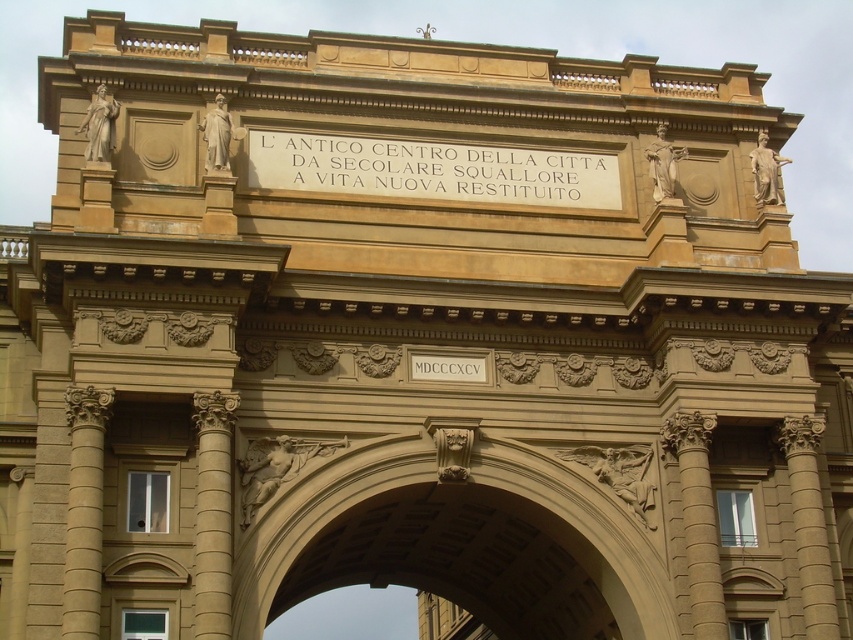
You are an architect inspecting the archway structure. You notice two columns, the beige stone column at left and the brown stone column at right. Which column is shorter?

The beige stone column at left is shorter than the brown stone column at right.

You are an architect examining the archway and need to determine the spatial relationship between the beige stone column at left and the brown stone column at right. Which column is closer to you as you face the archway?

The beige stone column at left is closer to you because it is in front of the brown stone column at right.